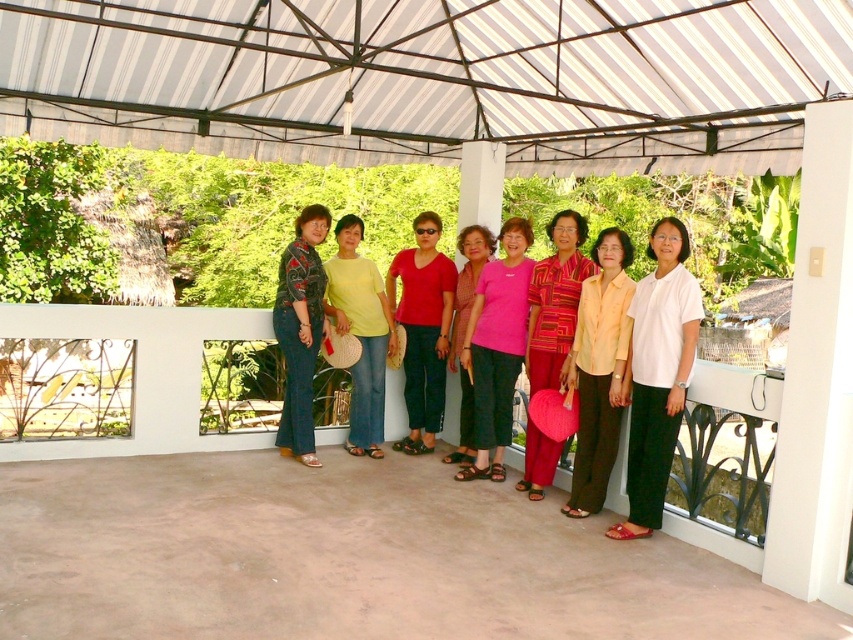
You are a photographer trying to adjust the lighting for a group photo. You notice the white matte blouse at center is positioned at coordinates 0.586 on the x and 0.771 on the y. Can you confirm if the blouse is within the central 60x60 pixel area of the image?

The white matte blouse at center is located at point (657, 374), which falls within the central 60x60 pixel area of the image.

You are a photographer trying to adjust the lighting for a group photo. You notice the white matte blouse at center and the textured pink fabric at center. Which item should you focus on to ensure it receives more light since it is closer to the camera?

The white matte blouse at center is in front of the textured pink fabric at center, so you should focus on the white matte blouse at center to ensure it receives more light since it is closer to the camera.

From the picture: You are a photographer taking a picture of the group. You notice the pink fabric shirt at center and the matte red shirt at center. Which one is positioned in front of the other?

The pink fabric shirt at center is closer to the viewer than the matte red shirt at center, so it is positioned in front of the matte red shirt at center.